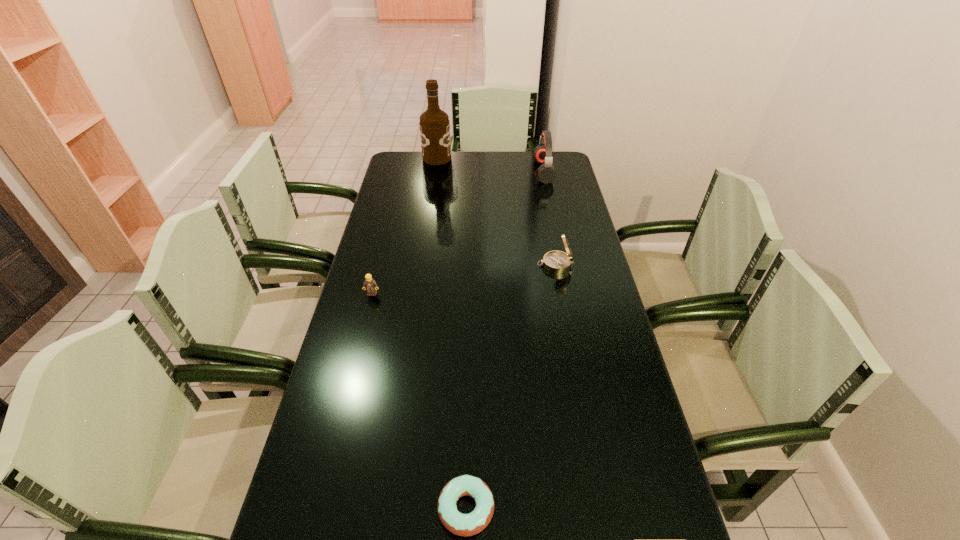
You are a GUI agent. You are given a task and a screenshot of the screen. Output one action in this format:
    pyautogui.click(x=<x>, y=<y>)
    Task: Click on the free location located 0.320m on the ear cups of the earphone
    The width and height of the screenshot is (960, 540).
    Given the screenshot: What is the action you would take?
    pyautogui.click(x=463, y=171)

Locate an element on the screen. free space located on the ear cups of the earphone is located at coordinates (483, 171).

Locate an element on the screen. vacant space located 0.180m on the ear cups of the earphone is located at coordinates (494, 171).

You are a GUI agent. You are given a task and a screenshot of the screen. Output one action in this format:
    pyautogui.click(x=<x>, y=<y>)
    Task: Click on the vacant area situated with the dial facing the third shortest object
    The width and height of the screenshot is (960, 540).
    Given the screenshot: What is the action you would take?
    click(x=508, y=265)

Identify the location of vacant space situated with the dial facing the third shortest object. Image resolution: width=960 pixels, height=540 pixels. (487, 265).

The width and height of the screenshot is (960, 540). What are the coordinates of `vacant region located with the dial facing the third shortest object` in the screenshot? It's located at (519, 265).

Identify the location of vacant region located in front of the fourth tallest object. The width and height of the screenshot is (960, 540). (366, 318).

Find the location of a particular element. The width and height of the screenshot is (960, 540). free spot located on the left of the nearest object is located at coordinates (380, 508).

I want to click on alcohol present at the far edge, so click(434, 123).

Locate an element on the screen. earphone positioned at the far edge is located at coordinates click(543, 152).